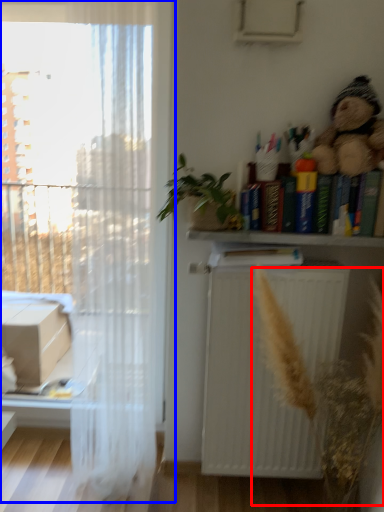
Question: Which point is further to the camera, plant (highlighted by a red box) or window (highlighted by a blue box)?

Choices:
 (A) plant
 (B) window

Answer: (B)